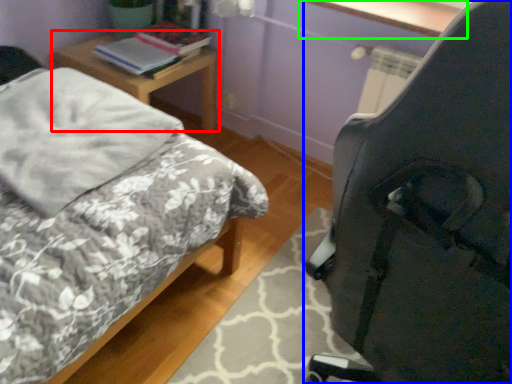
Question: Which is nearer to the nightstand (highlighted by a red box)? chair (highlighted by a blue box) or window sill (highlighted by a green box).

Choices:
 (A) chair
 (B) window sill

Answer: (B)